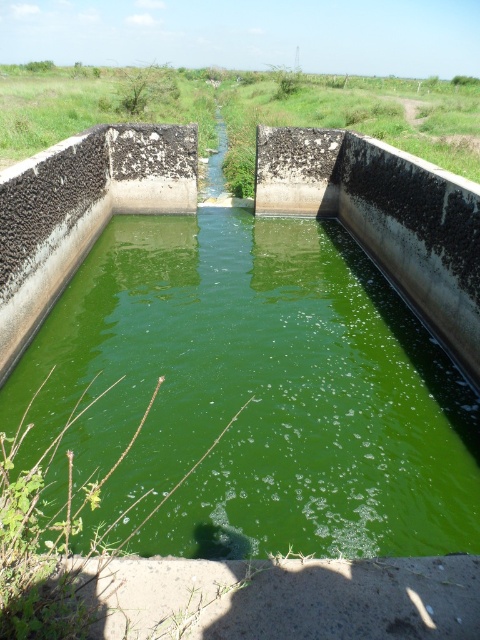
Question: Is green algae water at center to the left of gray concrete at bottom from the viewer's perspective?

Choices:
 (A) yes
 (B) no

Answer: (A)

Question: Does green algae water at center have a greater width compared to gray concrete at bottom?

Choices:
 (A) yes
 (B) no

Answer: (A)

Question: Which of the following is the farthest from the observer?

Choices:
 (A) green algae water at center
 (B) gray concrete at bottom

Answer: (A)

Question: Does green algae water at center appear over gray concrete at bottom?

Choices:
 (A) no
 (B) yes

Answer: (B)